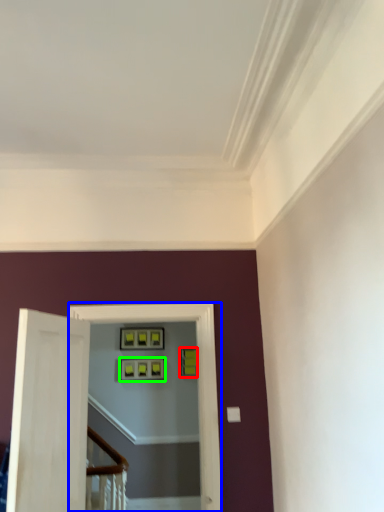
Question: Estimate the real-world distances between objects in this image. Which object is farther from picture frame (highlighted by a red box), passage (highlighted by a blue box) or picture frame (highlighted by a green box)?

Choices:
 (A) passage
 (B) picture frame

Answer: (A)